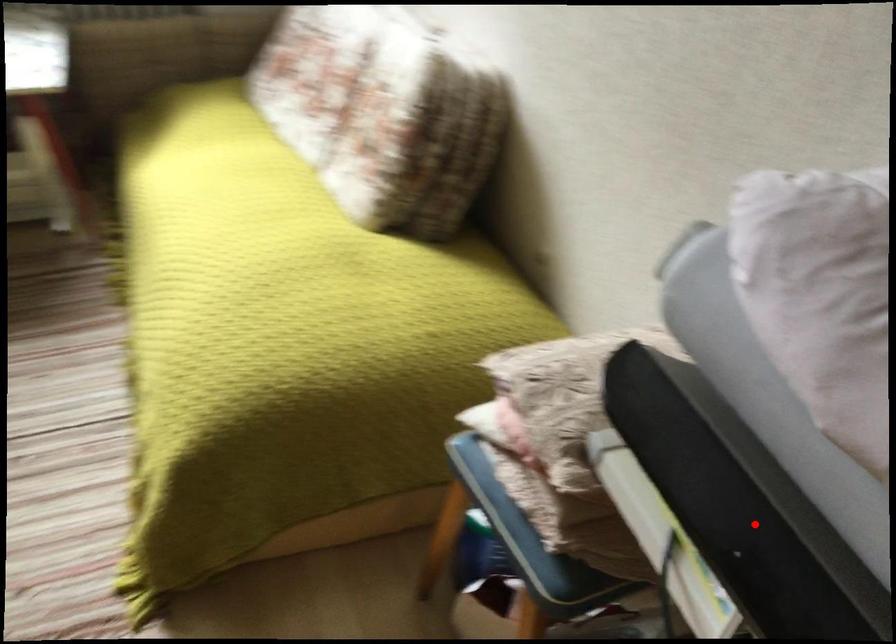
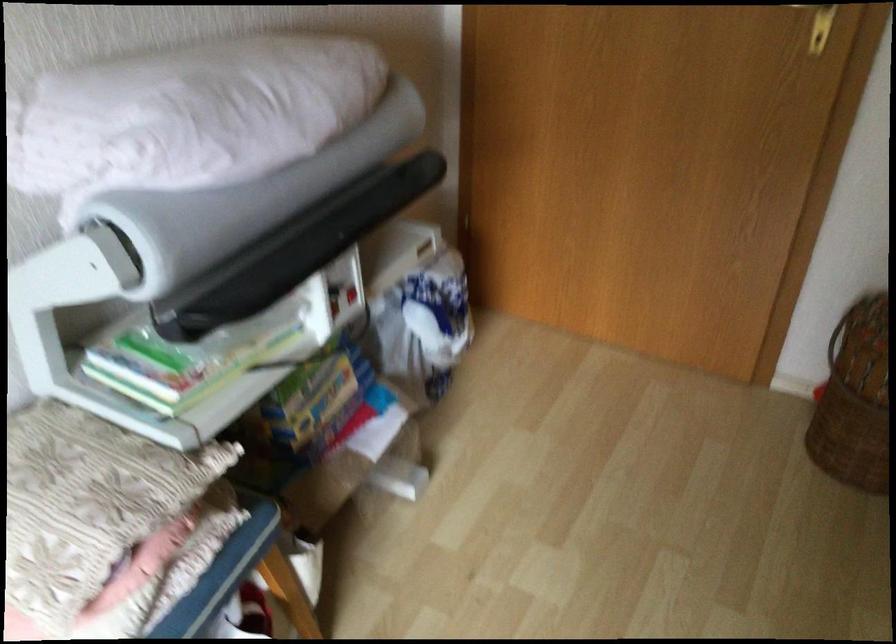
Question: A red point is marked in image1. In image2, is the corresponding 3D point closer to the camera or farther? Reply with the corresponding letter.

Choices:
 (A) The corresponding 3D point is closer.
 (B) The corresponding 3D point is farther.

Answer: (B)